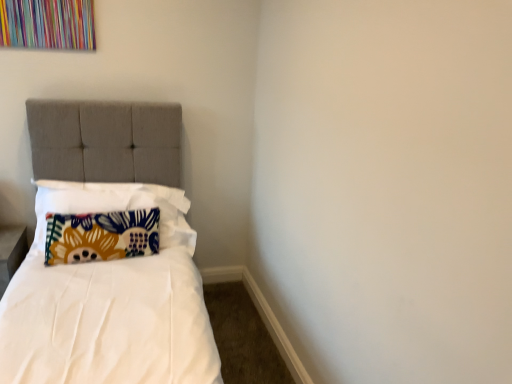
Measure the distance between point (39, 211) and camera.

7.16 feet.

The height and width of the screenshot is (384, 512). I want to click on floral fabric pillow at left, which is counted as the 1th pillow, starting from the front, so click(x=116, y=206).

The width and height of the screenshot is (512, 384). What do you see at coordinates (116, 206) in the screenshot?
I see `floral fabric pillow at left, which is counted as the 1th pillow, starting from the front` at bounding box center [116, 206].

You are a GUI agent. You are given a task and a screenshot of the screen. Output one action in this format:
    pyautogui.click(x=<x>, y=<y>)
    Task: Click on the floral fabric pillow at left, the 2th pillow from the front
    
    Given the screenshot: What is the action you would take?
    pyautogui.click(x=101, y=236)

This screenshot has width=512, height=384. What do you see at coordinates (101, 236) in the screenshot?
I see `floral fabric pillow at left, the 2th pillow from the front` at bounding box center [101, 236].

Locate an element on the screen. This screenshot has width=512, height=384. floral fabric pillow at left, arranged as the 2th pillow when viewed from the back is located at coordinates (116, 206).

Considering the relative positions of floral fabric pillow at left, arranged as the 1th pillow when viewed from the back, and floral fabric pillow at left, which is counted as the 1th pillow, starting from the front, in the image provided, is floral fabric pillow at left, arranged as the 1th pillow when viewed from the back, to the left of floral fabric pillow at left, which is counted as the 1th pillow, starting from the front, from the viewer's perspective?

Yes, floral fabric pillow at left, arranged as the 1th pillow when viewed from the back, is to the left of floral fabric pillow at left, which is counted as the 1th pillow, starting from the front.

Is floral fabric pillow at left, arranged as the 1th pillow when viewed from the back, closer to camera compared to floral fabric pillow at left, arranged as the 2th pillow when viewed from the back?

No.

Does point (79, 220) come closer to viewer compared to point (98, 190)?

Yes, point (79, 220) is in front of point (98, 190).

From the image's perspective, is floral fabric pillow at left, arranged as the 1th pillow when viewed from the back, on floral fabric pillow at left, arranged as the 2th pillow when viewed from the back?

No, from the image's perspective, floral fabric pillow at left, arranged as the 1th pillow when viewed from the back, is not above floral fabric pillow at left, arranged as the 2th pillow when viewed from the back.

From a real-world perspective, which object stands above the other?

From a 3D spatial view, floral fabric pillow at left, arranged as the 2th pillow when viewed from the back, is above.

Is floral fabric pillow at left, the 2th pillow from the front, wider than floral fabric pillow at left, which is counted as the 1th pillow, starting from the front?

In fact, floral fabric pillow at left, the 2th pillow from the front, might be narrower than floral fabric pillow at left, which is counted as the 1th pillow, starting from the front.

Can you confirm if floral fabric pillow at left, the 2th pillow from the front, is taller than floral fabric pillow at left, arranged as the 2th pillow when viewed from the back?

Incorrect, the height of floral fabric pillow at left, the 2th pillow from the front, is not larger of that of floral fabric pillow at left, arranged as the 2th pillow when viewed from the back.

Is floral fabric pillow at left, the 2th pillow from the front, bigger or smaller than floral fabric pillow at left, which is counted as the 1th pillow, starting from the front?

Considering their sizes, floral fabric pillow at left, the 2th pillow from the front, takes up less space than floral fabric pillow at left, which is counted as the 1th pillow, starting from the front.

Is floral fabric pillow at left, the 2th pillow from the front, not inside floral fabric pillow at left, arranged as the 2th pillow when viewed from the back?

No, most part of floral fabric pillow at left, the 2th pillow from the front, lies within floral fabric pillow at left, arranged as the 2th pillow when viewed from the back.

Is floral fabric pillow at left, arranged as the 1th pillow when viewed from the back, next to floral fabric pillow at left, which is counted as the 1th pillow, starting from the front, and touching it?

No, floral fabric pillow at left, arranged as the 1th pillow when viewed from the back, is not with floral fabric pillow at left, which is counted as the 1th pillow, starting from the front.

Could you tell me if floral fabric pillow at left, arranged as the 1th pillow when viewed from the back, is facing floral fabric pillow at left, arranged as the 2th pillow when viewed from the back?

Yes, floral fabric pillow at left, arranged as the 1th pillow when viewed from the back, faces towards floral fabric pillow at left, arranged as the 2th pillow when viewed from the back.

Can you tell me how much floral fabric pillow at left, the 2th pillow from the front, and floral fabric pillow at left, arranged as the 2th pillow when viewed from the back, differ in facing direction?

The angular difference between floral fabric pillow at left, the 2th pillow from the front, and floral fabric pillow at left, arranged as the 2th pillow when viewed from the back, is 4.29 degrees.

Could you measure the distance between floral fabric pillow at left, arranged as the 1th pillow when viewed from the back, and floral fabric pillow at left, which is counted as the 1th pillow, starting from the front?

A distance of 4.61 inches exists between floral fabric pillow at left, arranged as the 1th pillow when viewed from the back, and floral fabric pillow at left, which is counted as the 1th pillow, starting from the front.

Locate an element on the screen. The width and height of the screenshot is (512, 384). pillow on the left of floral fabric pillow at left, which is counted as the 1th pillow, starting from the front is located at coordinates (101, 236).

Based on the photo, between floral fabric pillow at left, which is counted as the 1th pillow, starting from the front, and floral fabric pillow at left, arranged as the 1th pillow when viewed from the back, which one appears on the left side from the viewer's perspective?

floral fabric pillow at left, arranged as the 1th pillow when viewed from the back, is more to the left.

Consider the image. Is floral fabric pillow at left, which is counted as the 1th pillow, starting from the front, in front of or behind floral fabric pillow at left, arranged as the 1th pillow when viewed from the back, in the image?

In the image, floral fabric pillow at left, which is counted as the 1th pillow, starting from the front, appears in front of floral fabric pillow at left, arranged as the 1th pillow when viewed from the back.

Between point (151, 202) and point (85, 254), which one is positioned behind?

The point (151, 202) is behind.

From the image's perspective, which one is positioned lower, floral fabric pillow at left, which is counted as the 1th pillow, starting from the front, or floral fabric pillow at left, the 2th pillow from the front?

floral fabric pillow at left, the 2th pillow from the front, is shown below in the image.

From a real-world perspective, is floral fabric pillow at left, which is counted as the 1th pillow, starting from the front, under floral fabric pillow at left, the 2th pillow from the front?

No, from a real-world perspective, floral fabric pillow at left, which is counted as the 1th pillow, starting from the front, is not under floral fabric pillow at left, the 2th pillow from the front.

Considering the sizes of objects floral fabric pillow at left, arranged as the 2th pillow when viewed from the back, and floral fabric pillow at left, the 2th pillow from the front, in the image provided, who is thinner, floral fabric pillow at left, arranged as the 2th pillow when viewed from the back, or floral fabric pillow at left, the 2th pillow from the front,?

Thinner between the two is floral fabric pillow at left, the 2th pillow from the front.

Looking at this image, is floral fabric pillow at left, arranged as the 2th pillow when viewed from the back, taller than floral fabric pillow at left, the 2th pillow from the front?

Yes, floral fabric pillow at left, arranged as the 2th pillow when viewed from the back, is taller than floral fabric pillow at left, the 2th pillow from the front.

In the scene shown: Is floral fabric pillow at left, arranged as the 2th pillow when viewed from the back, bigger than floral fabric pillow at left, arranged as the 1th pillow when viewed from the back?

Yes, floral fabric pillow at left, arranged as the 2th pillow when viewed from the back, is bigger than floral fabric pillow at left, arranged as the 1th pillow when viewed from the back.

Is floral fabric pillow at left, the 2th pillow from the front, inside floral fabric pillow at left, arranged as the 2th pillow when viewed from the back?

Yes, floral fabric pillow at left, arranged as the 2th pillow when viewed from the back, contains floral fabric pillow at left, the 2th pillow from the front.

Is floral fabric pillow at left, arranged as the 2th pillow when viewed from the back, placed right next to floral fabric pillow at left, the 2th pillow from the front?

No, floral fabric pillow at left, arranged as the 2th pillow when viewed from the back, is not touching floral fabric pillow at left, the 2th pillow from the front.

Is floral fabric pillow at left, which is counted as the 1th pillow, starting from the front, oriented towards floral fabric pillow at left, arranged as the 1th pillow when viewed from the back?

Yes, floral fabric pillow at left, which is counted as the 1th pillow, starting from the front, is aimed at floral fabric pillow at left, arranged as the 1th pillow when viewed from the back.

Measure the distance between floral fabric pillow at left, arranged as the 2th pillow when viewed from the back, and floral fabric pillow at left, the 2th pillow from the front.

A distance of 4.61 inches exists between floral fabric pillow at left, arranged as the 2th pillow when viewed from the back, and floral fabric pillow at left, the 2th pillow from the front.

At what (x,y) coordinates should I click in order to perform the action: click on pillow above the floral fabric pillow at left, the 2th pillow from the front (from a real-world perspective). Please return your answer as a coordinate pair (x, y). Looking at the image, I should click on (116, 206).

Locate an element on the screen. This screenshot has height=384, width=512. pillow that is on the left side of floral fabric pillow at left, arranged as the 2th pillow when viewed from the back is located at coordinates (101, 236).

At what (x,y) coordinates should I click in order to perform the action: click on pillow on the right of floral fabric pillow at left, arranged as the 1th pillow when viewed from the back. Please return your answer as a coordinate pair (x, y). The width and height of the screenshot is (512, 384). Looking at the image, I should click on (116, 206).